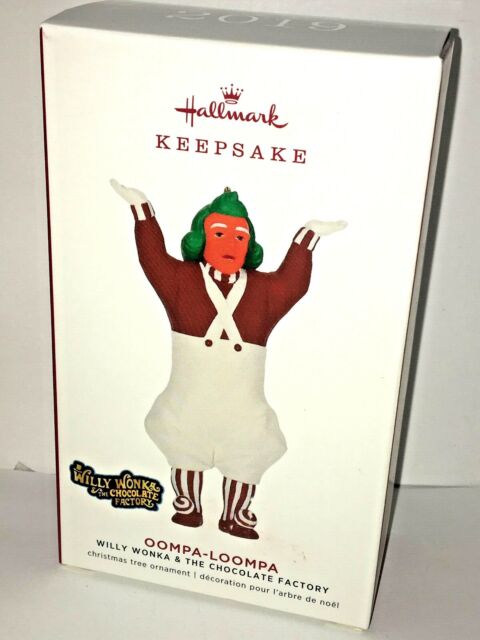
At what (x,y) coordinates should I click in order to perform the action: click on christmas tree ornament text. Please return your answer as a coordinate pair (x, y). The width and height of the screenshot is (480, 640). Looking at the image, I should click on (139, 564).